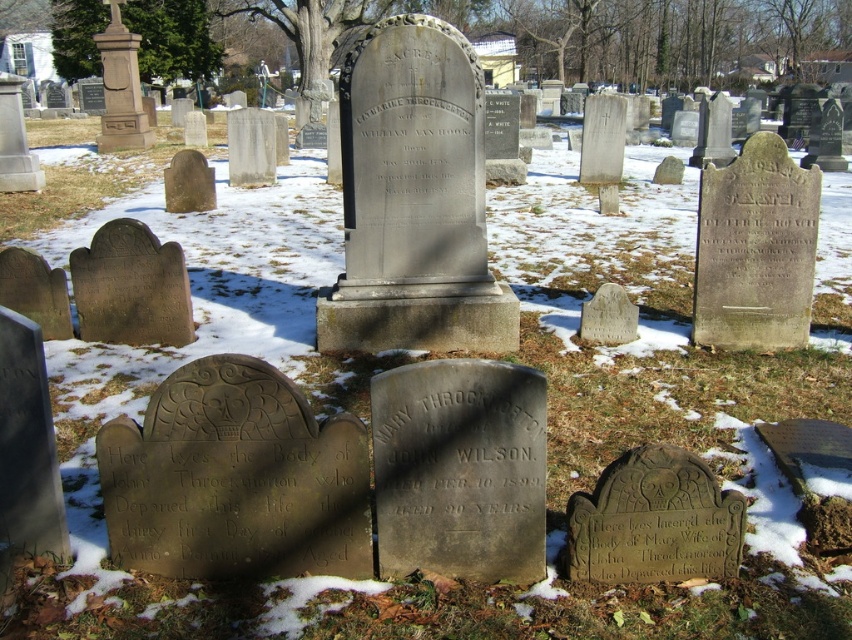
Is point (292, 26) closer to viewer compared to point (761, 28)?

Yes.

Is green textured tree at upper center positioned before bare wood tree at upper center?

Yes, green textured tree at upper center is closer to the viewer.

Which is in front, point (348, 22) or point (778, 51)?

Point (348, 22)

You are a GUI agent. You are given a task and a screenshot of the screen. Output one action in this format:
    pyautogui.click(x=<x>, y=<y>)
    Task: Click on the green textured tree at upper center
    The width and height of the screenshot is (852, 640).
    Given the screenshot: What is the action you would take?
    pyautogui.click(x=311, y=33)

Is green leafy tree at upper left to the right of bare wood tree at upper center from the viewer's perspective?

No, green leafy tree at upper left is not to the right of bare wood tree at upper center.

Is point (139, 58) more distant than point (797, 49)?

No, it is in front of (797, 49).

Find the location of a particular element. The height and width of the screenshot is (640, 852). green leafy tree at upper left is located at coordinates (171, 38).

Which of these two, green leafy tree at upper left or green textured tree at upper center, stands taller?

With more height is green textured tree at upper center.

Can you confirm if green leafy tree at upper left is taller than green textured tree at upper center?

No.

This screenshot has height=640, width=852. What do you see at coordinates (171, 38) in the screenshot?
I see `green leafy tree at upper left` at bounding box center [171, 38].

I want to click on green leafy tree at upper left, so click(x=171, y=38).